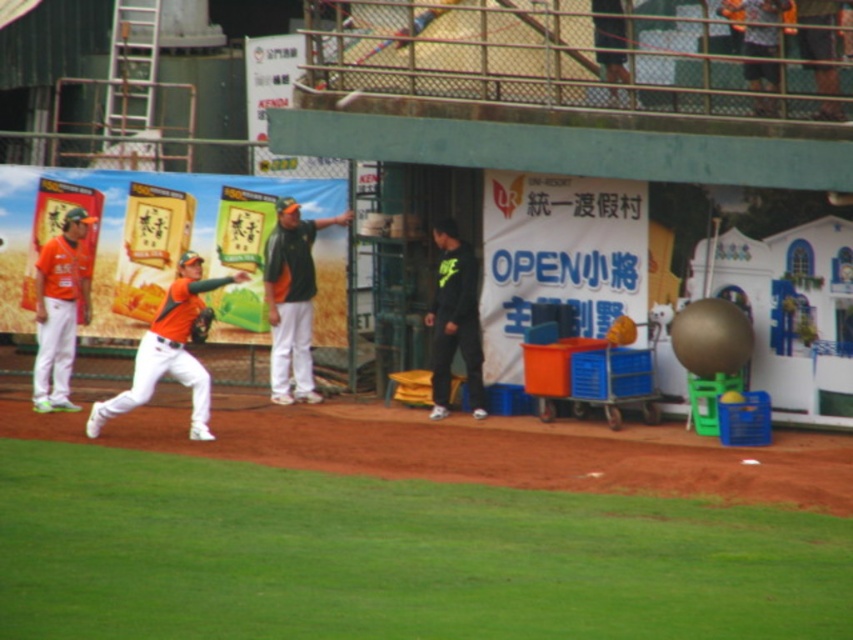
Does orange jersey at center have a larger size compared to orange jersey at left?

Indeed, orange jersey at center has a larger size compared to orange jersey at left.

Does orange jersey at center appear over orange jersey at left?

Yes.

Is point (282, 205) farther from camera compared to point (47, 410)?

Yes, point (282, 205) is behind point (47, 410).

The width and height of the screenshot is (853, 640). Find the location of `orange jersey at center`. orange jersey at center is located at coordinates (292, 300).

Measure the distance between point (143, 381) and camera.

Point (143, 381) and camera are 58.57 feet apart from each other.

Is point (186, 292) positioned before point (50, 368)?

Yes, point (186, 292) is closer to viewer.

Image resolution: width=853 pixels, height=640 pixels. Describe the element at coordinates (169, 352) in the screenshot. I see `orange matte baseball glove at center` at that location.

What are the coordinates of `orange matte baseball glove at center` in the screenshot? It's located at (169, 352).

Based on the photo, between orange jersey at left and black matte pants at center, which one has less height?

black matte pants at center is shorter.

Between point (62, 320) and point (433, 408), which one is positioned behind?

Positioned behind is point (433, 408).

Who is more distant from viewer, [85,280] or [445,264]?

The point [85,280] is behind.

You are a GUI agent. You are given a task and a screenshot of the screen. Output one action in this format:
    pyautogui.click(x=<x>, y=<y>)
    Task: Click on the orange jersey at left
    The image size is (853, 640).
    Given the screenshot: What is the action you would take?
    pyautogui.click(x=61, y=310)